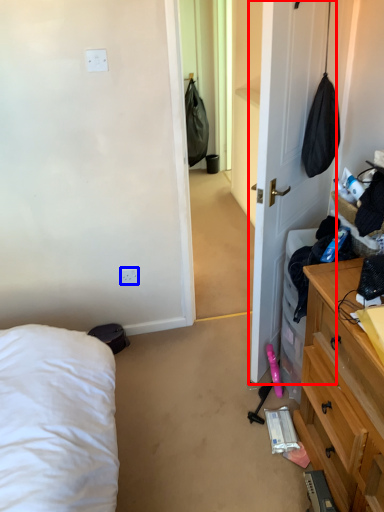
Question: Which of the following is the farthest to the observer, door (highlighted by a red box) or electric outlet (highlighted by a blue box)?

Choices:
 (A) door
 (B) electric outlet

Answer: (B)